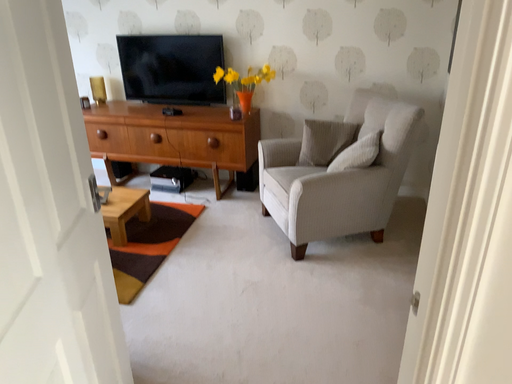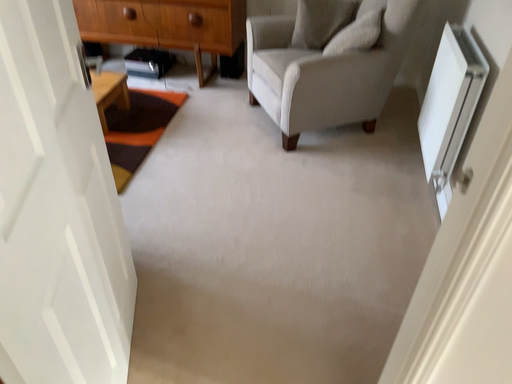
Question: How did the camera likely rotate when shooting the video?

Choices:
 (A) rotated downward
 (B) rotated upward

Answer: (A)